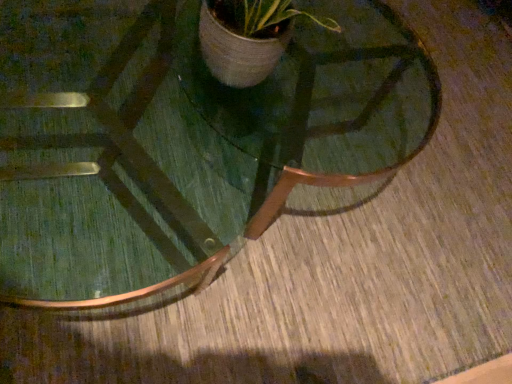
Question: Looking at the image, does green glass coffee table at center seem bigger or smaller compared to green wood table at center?

Choices:
 (A) big
 (B) small

Answer: (A)

Question: Considering the positions of green glass coffee table at center and green wood table at center in the image, is green glass coffee table at center wider or thinner than green wood table at center?

Choices:
 (A) thin
 (B) wide

Answer: (B)

Question: From the image's perspective, is green glass coffee table at center located above or below green wood table at center?

Choices:
 (A) above
 (B) below

Answer: (B)

Question: From a real-world perspective, is green wood table at center physically located above or below green glass coffee table at center?

Choices:
 (A) above
 (B) below

Answer: (A)

Question: Would you say green wood table at center is to the left or to the right of green glass coffee table at center in the picture?

Choices:
 (A) left
 (B) right

Answer: (B)

Question: From the image's perspective, is green wood table at center positioned above or below green glass coffee table at center?

Choices:
 (A) above
 (B) below

Answer: (A)

Question: In the image, is green wood table at center positioned in front of or behind green glass coffee table at center?

Choices:
 (A) front
 (B) behind

Answer: (A)